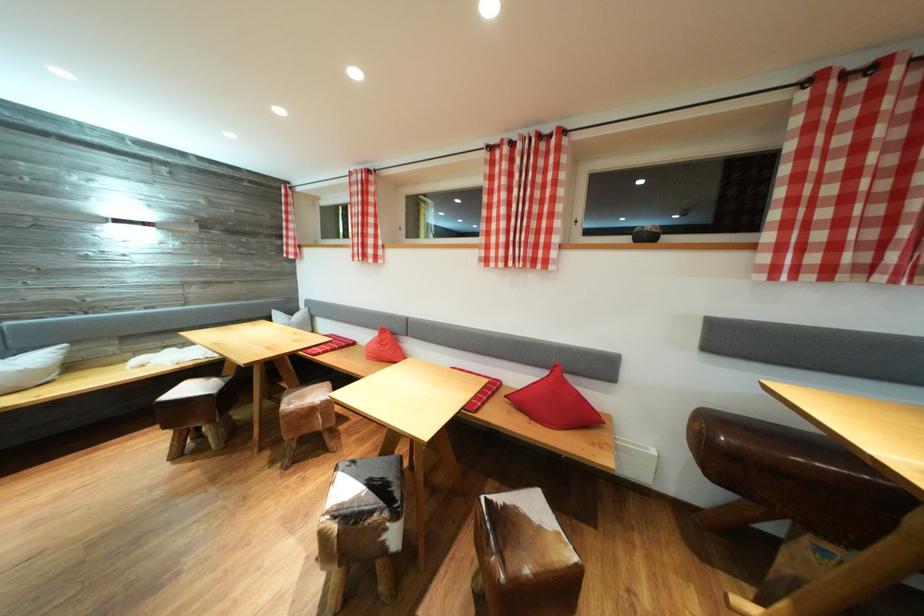
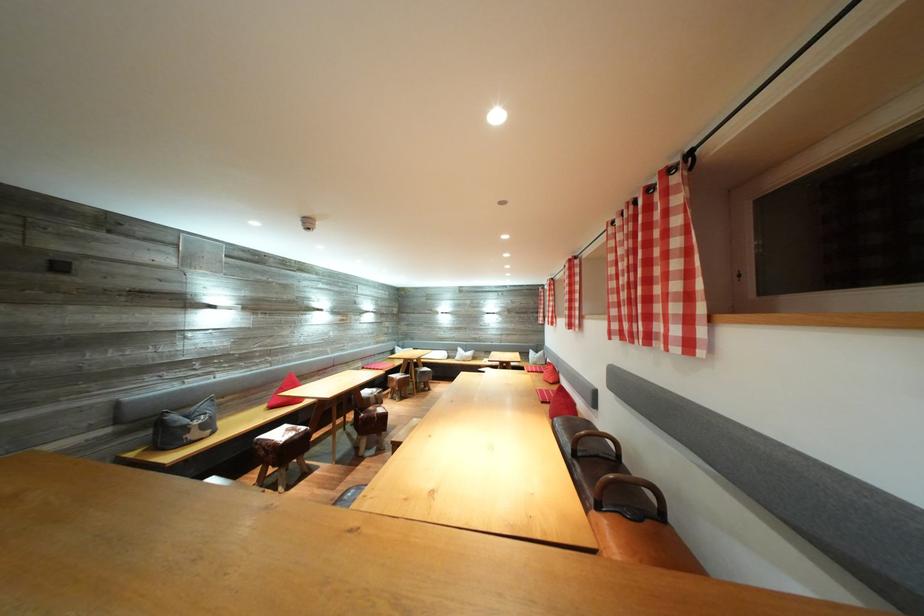
Question: I am providing you with two images of the same scene from different viewpoints. After the viewpoint changes to image2, which objects are now occluded?

Choices:
 (A) red checkered curtain
 (B) white throw pillow
 (C) dispensed tissue
 (D) cowhide stool seat

Answer: (D)